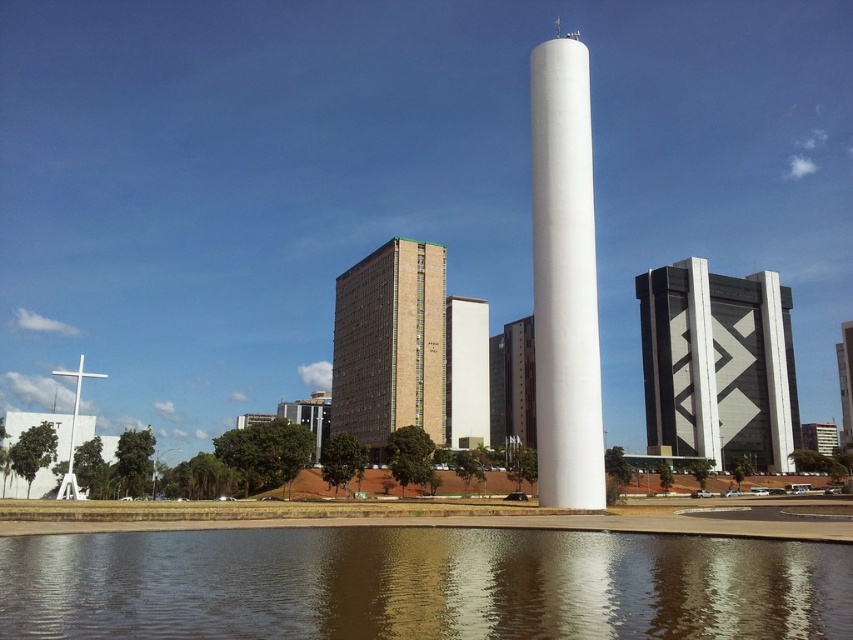
Question: Which is farther from the white matte cross at left?

Choices:
 (A) brown textured building at center
 (B) smooth reflective water at center
 (C) white smooth tower at center
 (D) white smooth obelisk at center

Answer: (D)

Question: Is smooth reflective water at center bigger than white smooth obelisk at center?

Choices:
 (A) yes
 (B) no

Answer: (B)

Question: Which object is the closest to the white matte cross at left?

Choices:
 (A) smooth reflective water at center
 (B) black glass building at right
 (C) white smooth tower at center

Answer: (A)

Question: Can you confirm if smooth reflective water at center is wider than brown textured building at center?

Choices:
 (A) no
 (B) yes

Answer: (B)

Question: Which point is closer to the camera?

Choices:
 (A) brown textured building at center
 (B) smooth reflective water at center
 (C) white smooth tower at center
 (D) white matte cross at left

Answer: (B)

Question: Can you confirm if brown textured building at center is positioned to the right of white smooth tower at center?

Choices:
 (A) no
 (B) yes

Answer: (A)